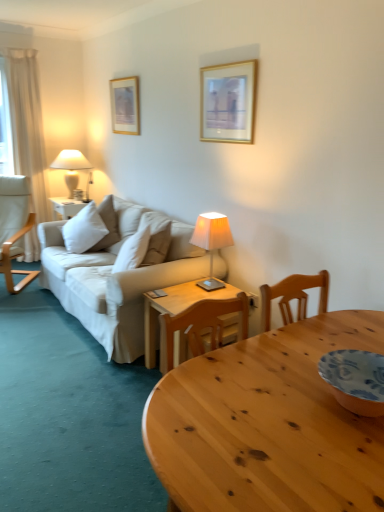
Question: Does gold-framed picture at upper left, which is counted as the second picture frame, starting from the front, appear on the left side of wooden table at center?

Choices:
 (A) yes
 (B) no

Answer: (A)

Question: Does gold-framed picture at upper left, which is counted as the second picture frame, starting from the front, have a smaller size compared to wooden table at center?

Choices:
 (A) no
 (B) yes

Answer: (B)

Question: Does gold-framed picture at upper left, which appears as the 2th picture frame when viewed from the right, contain wooden table at center?

Choices:
 (A) yes
 (B) no

Answer: (B)

Question: Can you confirm if gold-framed picture at upper left, which ranks as the first picture frame in back-to-front order, is positioned to the right of wooden table at center?

Choices:
 (A) no
 (B) yes

Answer: (A)

Question: Is gold-framed picture at upper left, placed as the first picture frame when sorted from left to right, facing away from wooden table at center?

Choices:
 (A) no
 (B) yes

Answer: (A)

Question: Is white fabric lampshade at left, acting as the 1th lamp starting from the left, looking in the opposite direction of ivory fabric lampshade at center, marked as the first lamp in a front-to-back arrangement?

Choices:
 (A) no
 (B) yes

Answer: (A)

Question: Can you confirm if white fabric lampshade at left, acting as the 1th lamp starting from the left, is taller than ivory fabric lampshade at center, arranged as the second lamp when viewed from the back?

Choices:
 (A) yes
 (B) no

Answer: (A)

Question: Considering the relative positions of white fabric lampshade at left, marked as the 1th lamp in a top-to-bottom arrangement, and ivory fabric lampshade at center, placed as the first lamp when sorted from bottom to top, in the image provided, is white fabric lampshade at left, marked as the 1th lamp in a top-to-bottom arrangement, to the left of ivory fabric lampshade at center, placed as the first lamp when sorted from bottom to top, from the viewer's perspective?

Choices:
 (A) yes
 (B) no

Answer: (A)

Question: Is white fabric lampshade at left, which is the 2th lamp in right-to-left order, further to the viewer compared to ivory fabric lampshade at center, which ranks as the second lamp in top-to-bottom order?

Choices:
 (A) yes
 (B) no

Answer: (A)

Question: Can you confirm if white fabric lampshade at left, which is the 2th lamp in right-to-left order, is wider than ivory fabric lampshade at center, which ranks as the second lamp in top-to-bottom order?

Choices:
 (A) yes
 (B) no

Answer: (A)

Question: From the image's perspective, is white fabric lampshade at left, which is the 2th lamp in right-to-left order, located above ivory fabric lampshade at center, which ranks as the second lamp in top-to-bottom order?

Choices:
 (A) yes
 (B) no

Answer: (A)

Question: Would you say gold-framed picture at upper left, which ranks as the first picture frame in back-to-front order, is part of wooden table at center's contents?

Choices:
 (A) no
 (B) yes

Answer: (A)